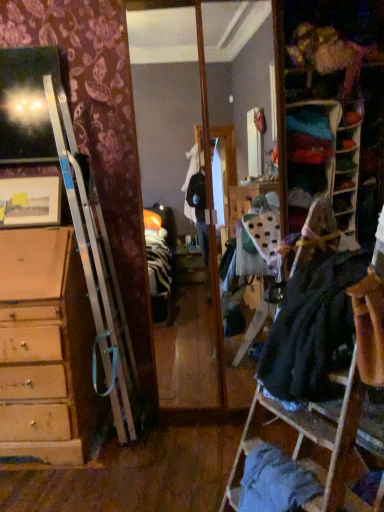
Question: Does blue cotton shirt at lower right, the first clothing from the bottom, have a lesser height compared to velvet fabric bookshelf at upper right?

Choices:
 (A) no
 (B) yes

Answer: (B)

Question: From a real-world perspective, is blue cotton shirt at lower right, marked as the second clothing in a top-to-bottom arrangement, positioned over velvet fabric bookshelf at upper right based on gravity?

Choices:
 (A) yes
 (B) no

Answer: (B)

Question: Is blue cotton shirt at lower right, marked as the second clothing in a top-to-bottom arrangement, with velvet fabric bookshelf at upper right?

Choices:
 (A) yes
 (B) no

Answer: (B)

Question: Does blue cotton shirt at lower right, marked as the second clothing in a top-to-bottom arrangement, have a smaller size compared to velvet fabric bookshelf at upper right?

Choices:
 (A) no
 (B) yes

Answer: (A)

Question: Considering the relative sizes of blue cotton shirt at lower right, the first clothing from the bottom, and velvet fabric bookshelf at upper right in the image provided, is blue cotton shirt at lower right, the first clothing from the bottom, wider than velvet fabric bookshelf at upper right?

Choices:
 (A) no
 (B) yes

Answer: (B)

Question: Is blue cotton shirt at lower right, the first clothing from the bottom, taller than velvet fabric bookshelf at upper right?

Choices:
 (A) yes
 (B) no

Answer: (B)

Question: Is dark gray fabric dress at right, acting as the first clothing starting from the top, turned away from blue cotton shirt at lower right, the first clothing from the bottom?

Choices:
 (A) yes
 (B) no

Answer: (B)

Question: Does dark gray fabric dress at right, positioned as the second clothing in bottom-to-top order, turn towards blue cotton shirt at lower right, marked as the second clothing in a top-to-bottom arrangement?

Choices:
 (A) yes
 (B) no

Answer: (B)

Question: Is dark gray fabric dress at right, acting as the first clothing starting from the top, in front of blue cotton shirt at lower right, marked as the second clothing in a top-to-bottom arrangement?

Choices:
 (A) no
 (B) yes

Answer: (B)

Question: Is dark gray fabric dress at right, acting as the first clothing starting from the top, thinner than blue cotton shirt at lower right, the first clothing from the bottom?

Choices:
 (A) yes
 (B) no

Answer: (B)

Question: Is dark gray fabric dress at right, positioned as the second clothing in bottom-to-top order, further to camera compared to blue cotton shirt at lower right, the first clothing from the bottom?

Choices:
 (A) no
 (B) yes

Answer: (A)

Question: From a real-world perspective, is dark gray fabric dress at right, positioned as the second clothing in bottom-to-top order, physically below blue cotton shirt at lower right, marked as the second clothing in a top-to-bottom arrangement?

Choices:
 (A) no
 (B) yes

Answer: (A)

Question: Is matte wooden picture frame at upper left at the right side of velvet fabric bookshelf at upper right?

Choices:
 (A) yes
 (B) no

Answer: (B)